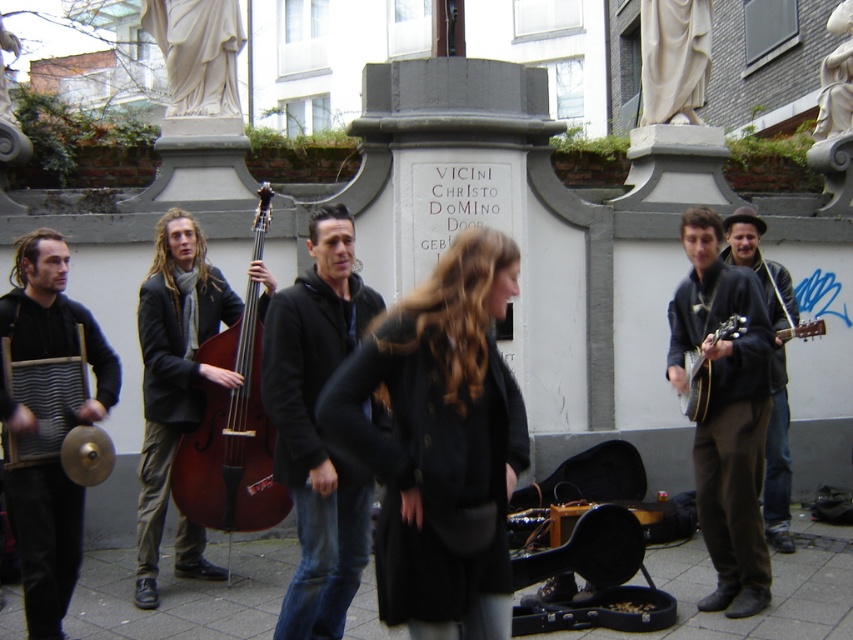
Measure the distance between black matte jacket at center and camera.

black matte jacket at center is 5.08 meters from camera.

Can you confirm if black matte jacket at center is wider than dark brown leather jacket at right?

Yes.

Is point (294, 609) farther from viewer compared to point (750, 452)?

No, (294, 609) is closer to viewer.

The height and width of the screenshot is (640, 853). Find the location of `black matte jacket at center`. black matte jacket at center is located at coordinates (316, 426).

Based on the photo, is mahogany wood cello at center smaller than shiny black guitar at right?

Actually, mahogany wood cello at center might be larger than shiny black guitar at right.

Looking at this image, measure the distance between point [196,508] and camera.

Point [196,508] is 21.69 feet away from camera.

What are the coordinates of `mahogany wood cello at center` in the screenshot? It's located at (231, 436).

Between black matte jacket at center and shiny black guitar at right, which one has less height?

shiny black guitar at right

Can you confirm if black matte jacket at center is positioned to the left of shiny black guitar at right?

Correct, you'll find black matte jacket at center to the left of shiny black guitar at right.

Is point (321, 513) farther from viewer compared to point (705, 362)?

No, (321, 513) is closer to viewer.

Identify the location of black matte jacket at center. (316, 426).